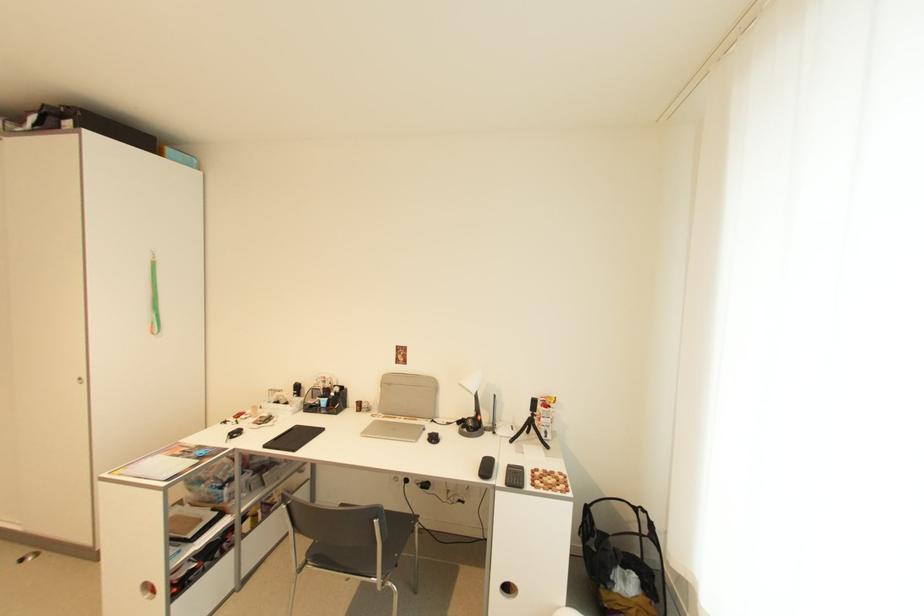
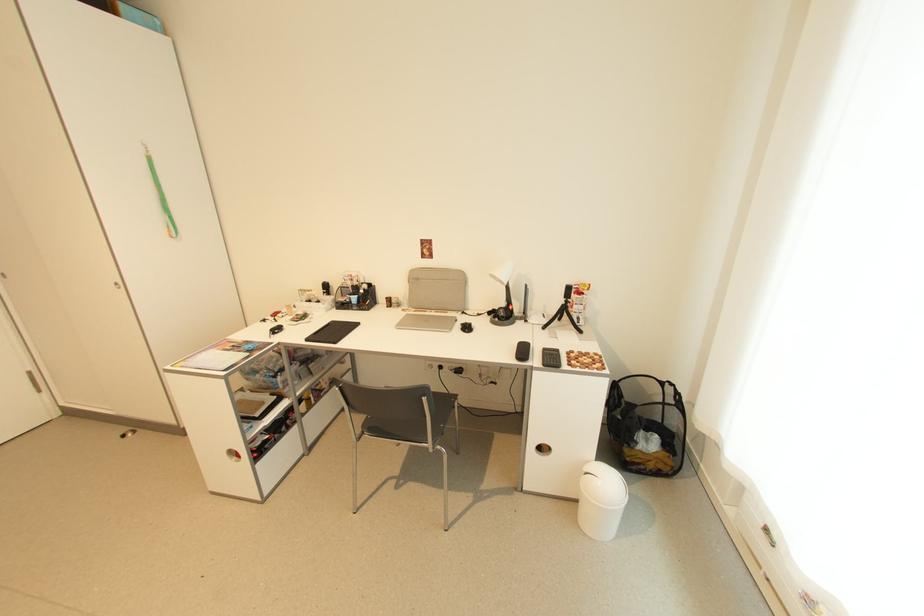
In the second image, find the point that corresponds to (477,416) in the first image.

(507, 306)